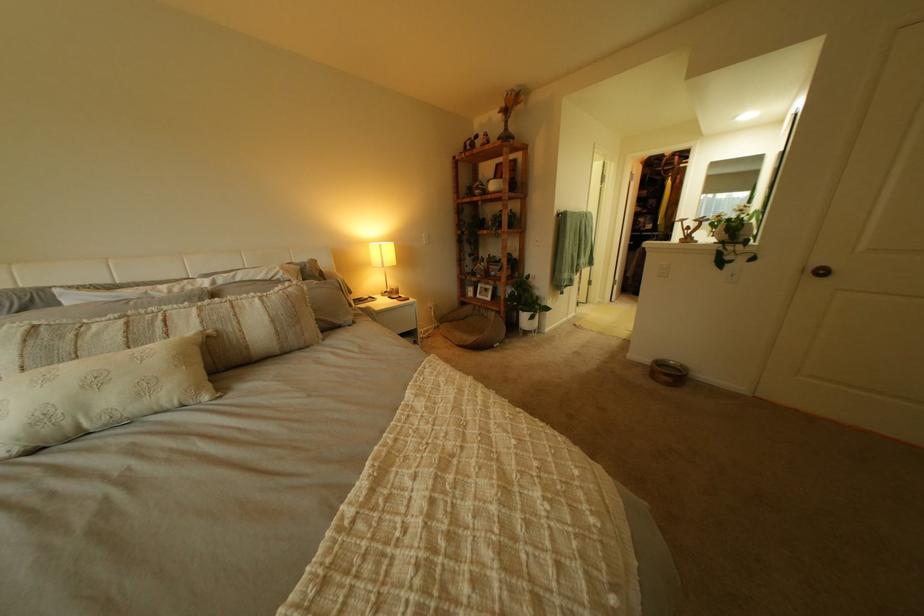
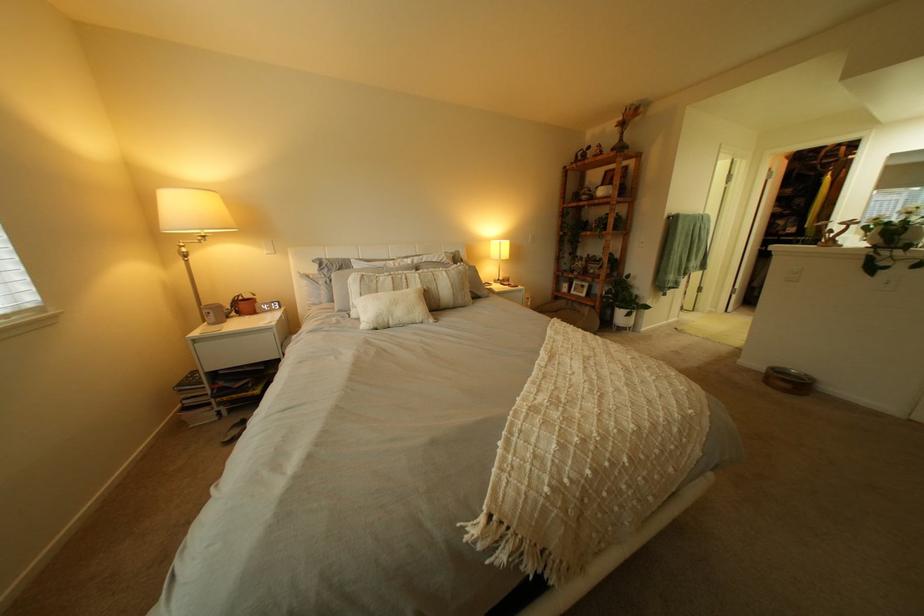
Where in the second image is the point corresponding to point (536, 308) from the first image?

(633, 305)